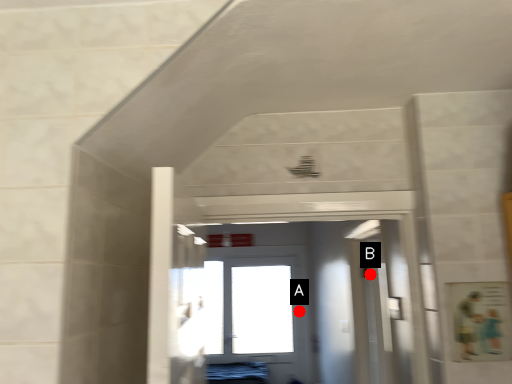
Question: Two points are circled on the image, labeled by A and B beside each circle. Which point is closer to the camera taking this photo?

Choices:
 (A) A is closer
 (B) B is closer

Answer: (B)